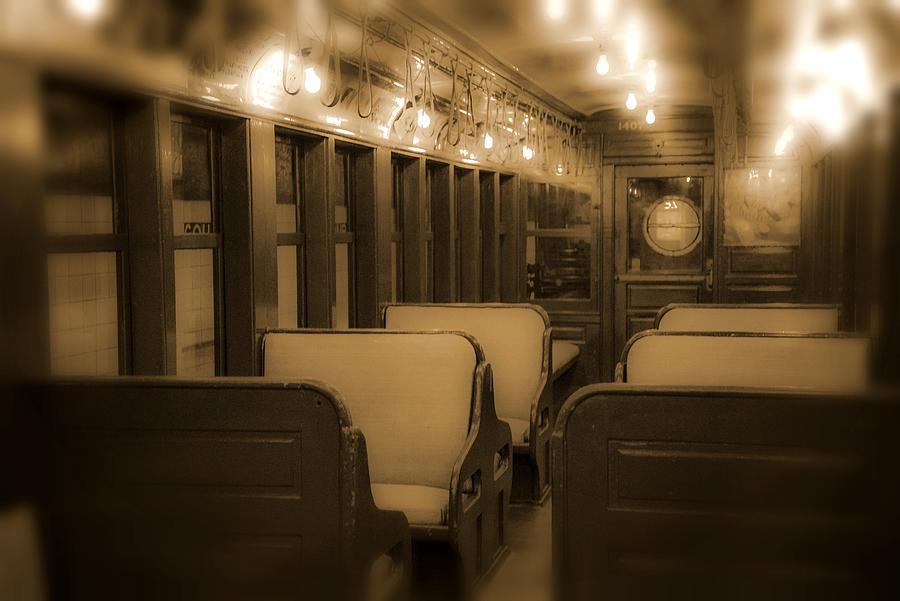
Locate an element on the screen. The image size is (900, 601). floor is located at coordinates (528, 575).